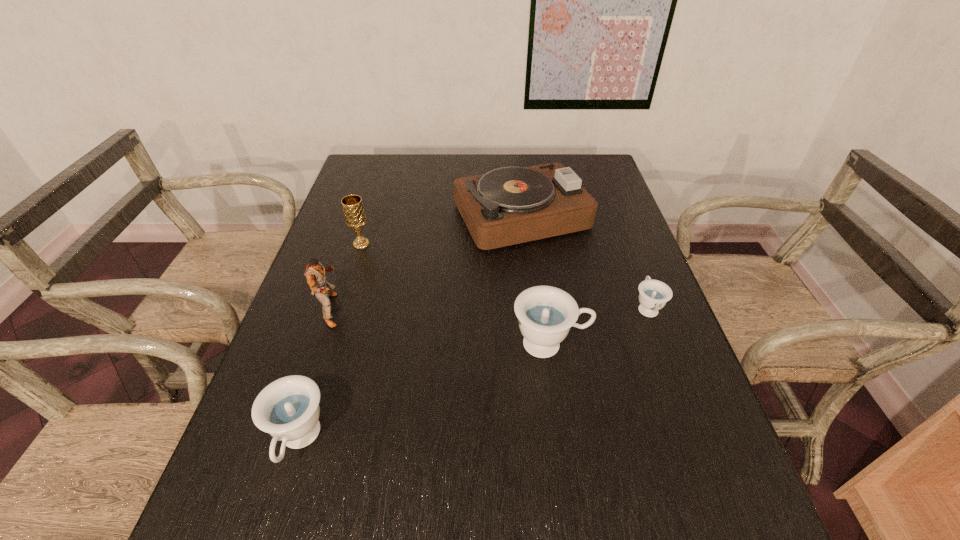
Identify the location of vacant area that lies between the record player and the rightmost teacup. This screenshot has height=540, width=960. (585, 261).

This screenshot has width=960, height=540. I want to click on free spot between the chalice and the puncher, so click(347, 277).

Find the location of `free point between the second shortest object and the rightmost teacup`. free point between the second shortest object and the rightmost teacup is located at coordinates (473, 374).

Where is `free spot between the shortest object and the leftmost teacup`? The image size is (960, 540). free spot between the shortest object and the leftmost teacup is located at coordinates click(x=473, y=374).

Identify the location of vacant point located between the puncher and the record player. (427, 263).

Locate an element on the screen. vacant space that is in between the record player and the chalice is located at coordinates (442, 230).

Locate an element on the screen. This screenshot has height=540, width=960. free space between the chalice and the record player is located at coordinates (442, 230).

Locate an element on the screen. The image size is (960, 540). vacant space in between the second teacup from right to left and the chalice is located at coordinates (456, 294).

The width and height of the screenshot is (960, 540). In order to click on object that is the fourth closest to the second shortest teacup in this screenshot , I will do `click(506, 206)`.

Identify which object is the third closest to the shortest teacup. Please provide its 2D coordinates. Your answer should be formatted as a tuple, i.e. [(x, y)], where the tuple contains the x and y coordinates of a point satisfying the conditions above.

[(288, 409)]